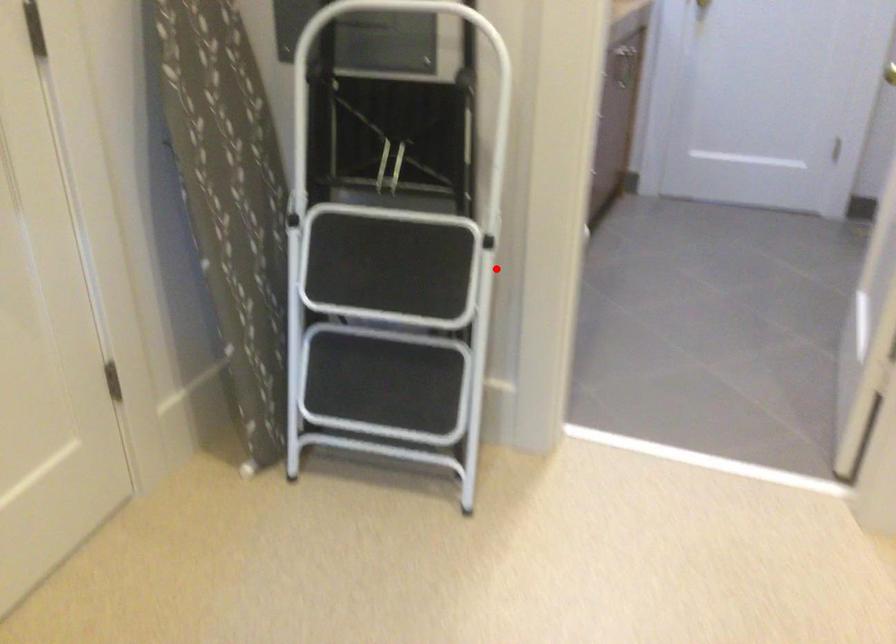
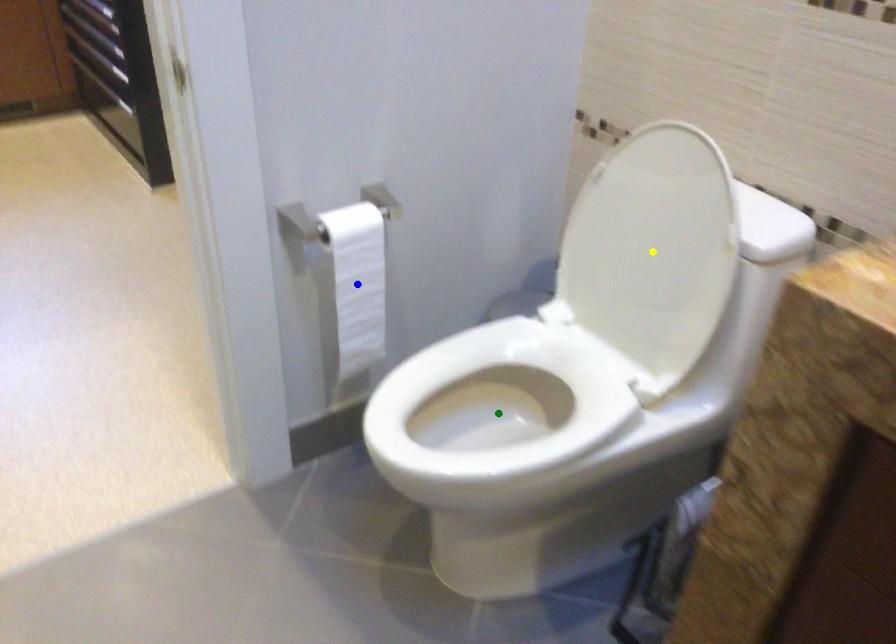
Question: I am providing you with two images of the same scene from different viewpoints. A red point is marked on the first image. You are given multiple points on the second image. Can you choose the point in image 2 that corresponds to the point in image 1?

Choices:
 (A) green point
 (B) blue point
 (C) yellow point

Answer: (B)